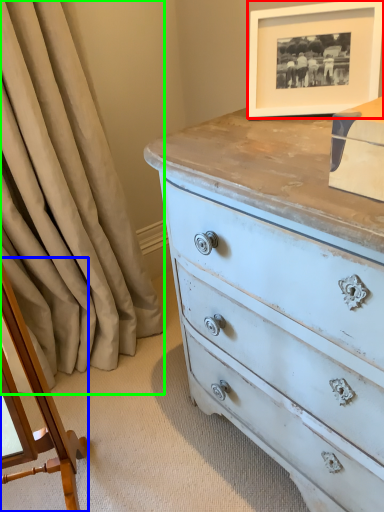
Question: Which is farther away from picture frame (highlighted by a red box)? changing table (highlighted by a blue box) or curtain (highlighted by a green box)?

Choices:
 (A) changing table
 (B) curtain

Answer: (A)